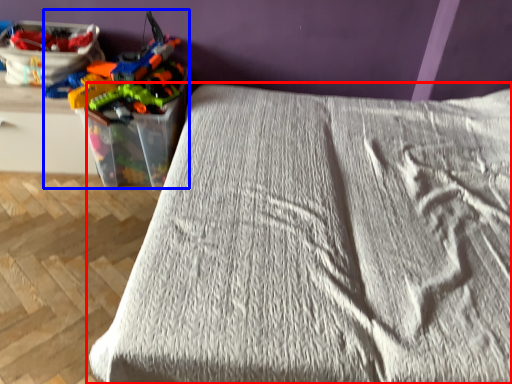
Question: Which object appears farthest to the camera in this image, bed (highlighted by a red box) or toy (highlighted by a blue box)?

Choices:
 (A) bed
 (B) toy

Answer: (B)